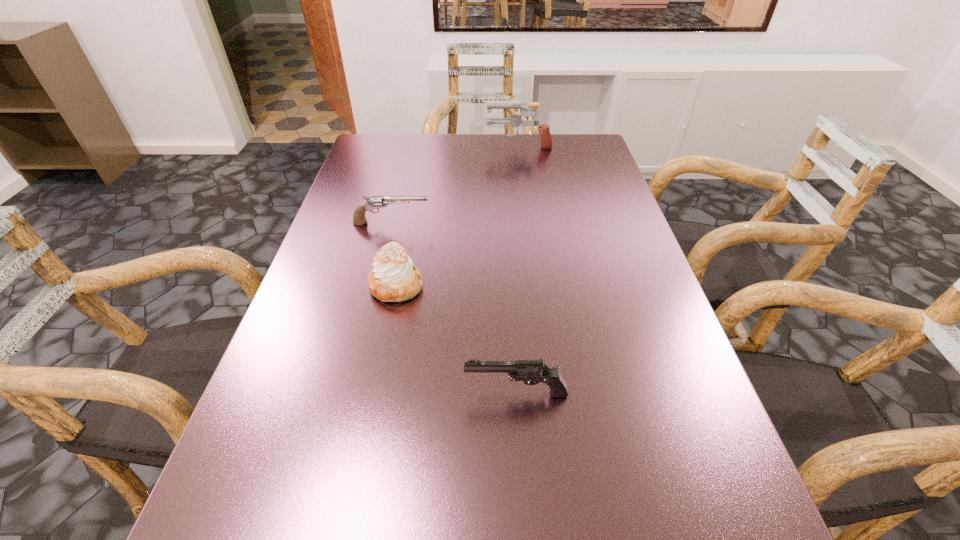
Find the location of a particular element. the farthest gun is located at coordinates (515, 120).

Image resolution: width=960 pixels, height=540 pixels. What are the coordinates of `the farthest object` in the screenshot? It's located at (515, 120).

The height and width of the screenshot is (540, 960). In order to click on the second nearest object in this screenshot , I will do 393,278.

Find the location of a particular element. Image resolution: width=960 pixels, height=540 pixels. the nearest gun is located at coordinates (531, 372).

Image resolution: width=960 pixels, height=540 pixels. I want to click on the shortest object, so click(374, 202).

Locate an element on the screen. This screenshot has width=960, height=540. the leftmost gun is located at coordinates (374, 202).

The width and height of the screenshot is (960, 540). I want to click on vacant space located 0.340m at the barrel end of the tallest object, so click(378, 145).

Image resolution: width=960 pixels, height=540 pixels. Identify the location of free space located at the barrel end of the tallest object. (417, 145).

Locate an element on the screen. The height and width of the screenshot is (540, 960). free space located 0.160m at the barrel end of the tallest object is located at coordinates (436, 145).

Locate an element on the screen. The width and height of the screenshot is (960, 540). vacant space located 0.400m on the front of the pastry is located at coordinates (349, 523).